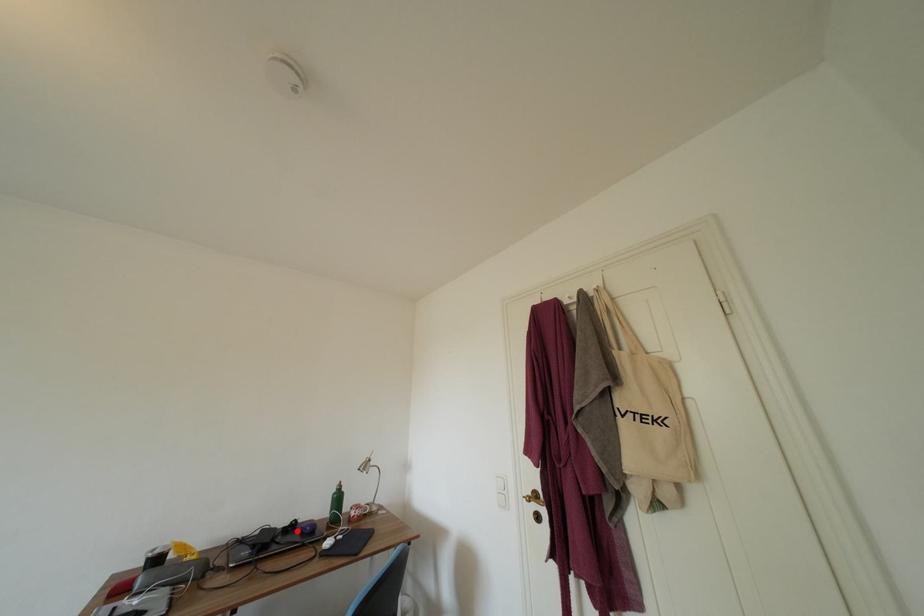
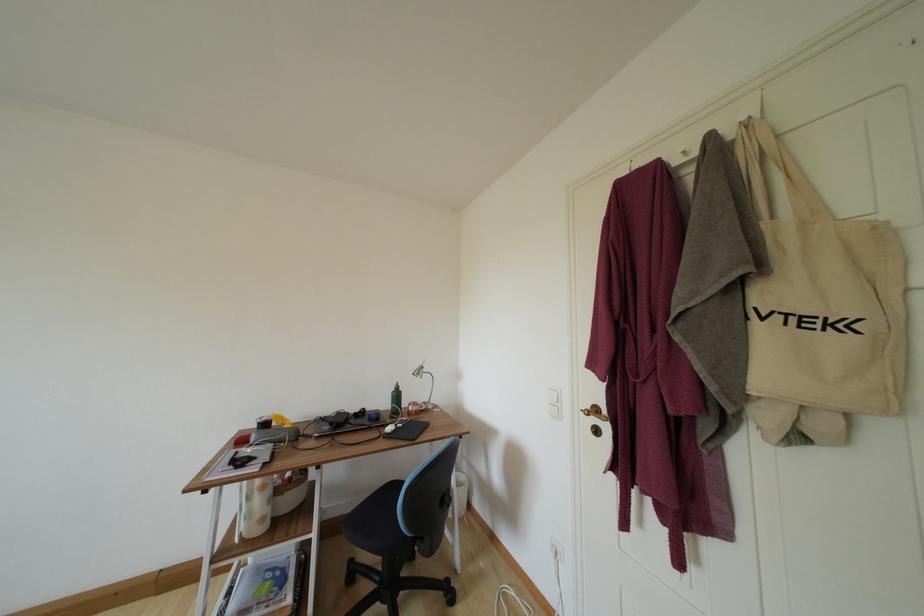
Question: I am providing you with two images of the same scene from different viewpoints. A red point is shown in image1. For the corresponding object point in image2, is it positioned nearer or farther from the camera?

Choices:
 (A) Nearer
 (B) Farther

Answer: (B)